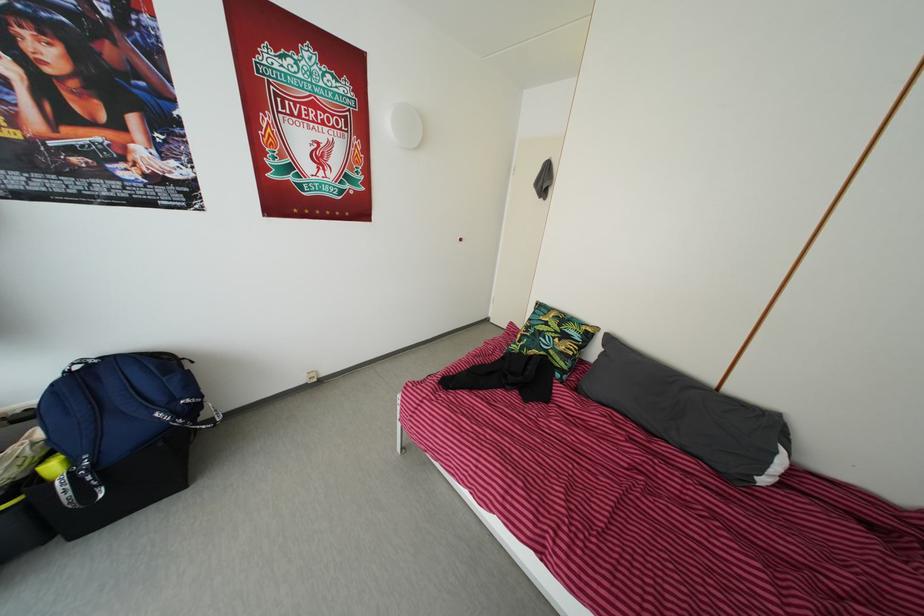
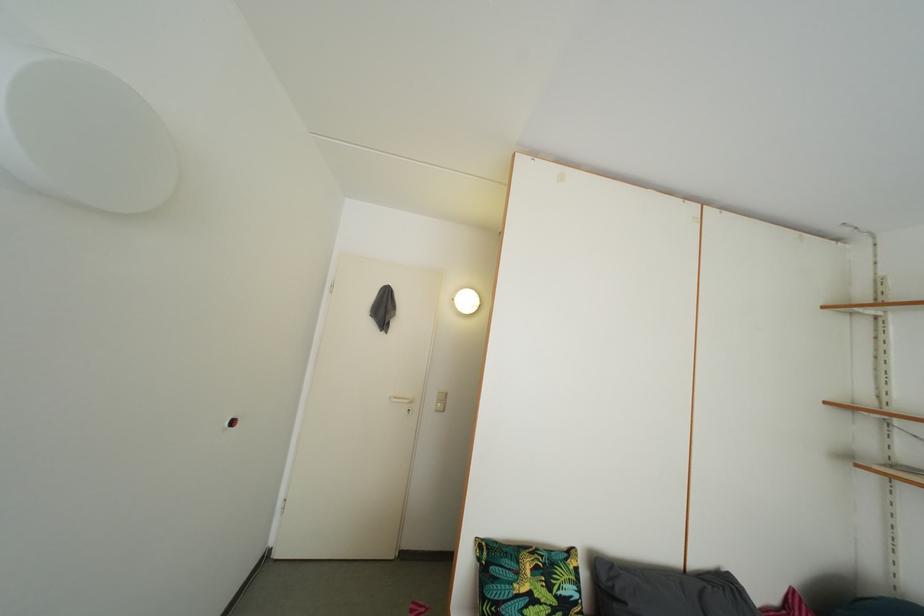
Find the pixel in the second image that matches pixel 556 317 in the first image.

(521, 562)